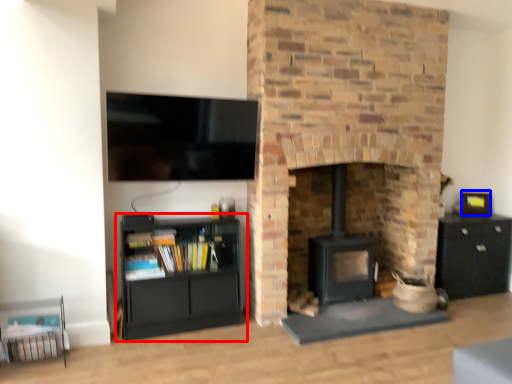
Question: Which object is closer to the camera taking this photo, shelf (highlighted by a red box) or picture frame (highlighted by a blue box)?

Choices:
 (A) shelf
 (B) picture frame

Answer: (A)